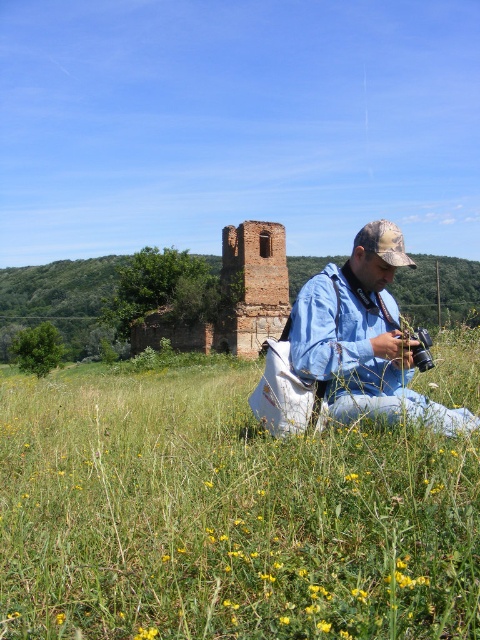
Question: Considering the relative positions of blue denim jacket at center and brown brick ruins at center in the image provided, where is blue denim jacket at center located with respect to brown brick ruins at center?

Choices:
 (A) below
 (B) above

Answer: (A)

Question: Which object is positioned farthest from the brown brick ruins at center?

Choices:
 (A) green grass at center
 (B) blue denim jacket at center

Answer: (B)

Question: Can you confirm if blue denim jacket at center is smaller than brown brick ruins at center?

Choices:
 (A) yes
 (B) no

Answer: (A)

Question: Which of the following is the farthest from the observer?

Choices:
 (A) green grass at center
 (B) brown brick ruins at center
 (C) blue denim jacket at center

Answer: (B)

Question: Does green grass at center have a greater width compared to blue denim jacket at center?

Choices:
 (A) yes
 (B) no

Answer: (A)

Question: Estimate the real-world distances between objects in this image. Which object is closer to the brown brick ruins at center?

Choices:
 (A) green grass at center
 (B) blue denim jacket at center

Answer: (A)